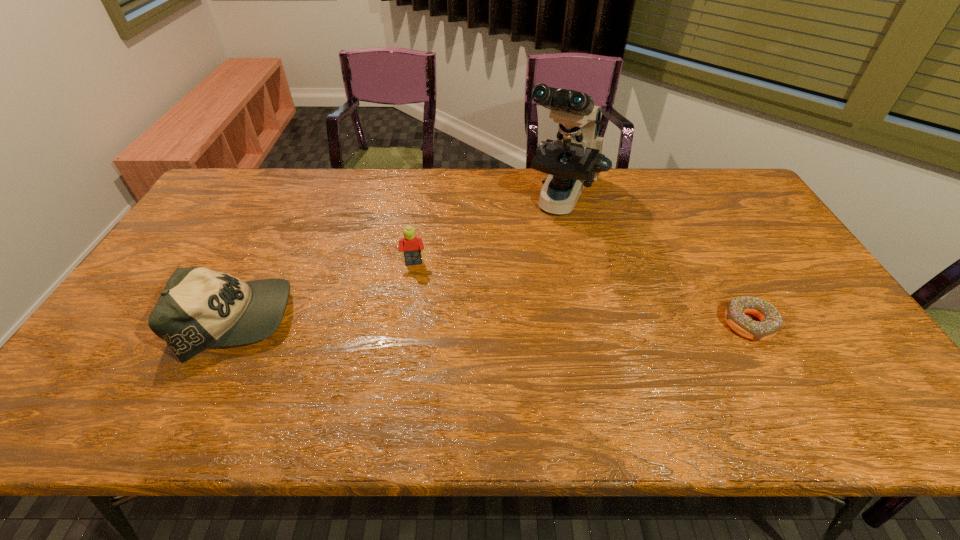
Image resolution: width=960 pixels, height=540 pixels. In order to click on the leftmost object in this screenshot , I will do click(x=199, y=308).

You are a GUI agent. You are given a task and a screenshot of the screen. Output one action in this format:
    pyautogui.click(x=<x>, y=<y>)
    Task: Click on the rightmost object
    Image resolution: width=960 pixels, height=540 pixels.
    Given the screenshot: What is the action you would take?
    pyautogui.click(x=770, y=323)

I want to click on the shortest object, so coord(770,323).

Locate an element on the screen. The height and width of the screenshot is (540, 960). the second object from right to left is located at coordinates (573, 161).

You are a GUI agent. You are given a task and a screenshot of the screen. Output one action in this format:
    pyautogui.click(x=<x>, y=<y>)
    Task: Click on the tallest object
    The height and width of the screenshot is (540, 960).
    Given the screenshot: What is the action you would take?
    pyautogui.click(x=573, y=161)

Where is `the third object from right to left`? the third object from right to left is located at coordinates (412, 246).

Identify the location of the second farthest object. Image resolution: width=960 pixels, height=540 pixels. (412, 246).

You are a GUI agent. You are given a task and a screenshot of the screen. Output one action in this format:
    pyautogui.click(x=<x>, y=<y>)
    Task: Click on the free space located 0.160m on the front-facing side of the baseball cap
    
    Given the screenshot: What is the action you would take?
    pyautogui.click(x=354, y=321)

Identify the location of free space located 0.250m on the back of the shortest object. Image resolution: width=960 pixels, height=540 pixels. (705, 243).

The height and width of the screenshot is (540, 960). Find the location of `free spot located 0.060m through the eyepieces of the farthest object`. free spot located 0.060m through the eyepieces of the farthest object is located at coordinates (544, 248).